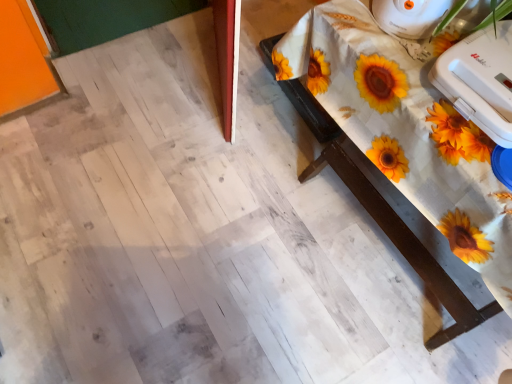
Where is `blank space to the left of white plastic iron at upper right, the 1th appliance positioned from the top`? The image size is (512, 384). blank space to the left of white plastic iron at upper right, the 1th appliance positioned from the top is located at coordinates (353, 23).